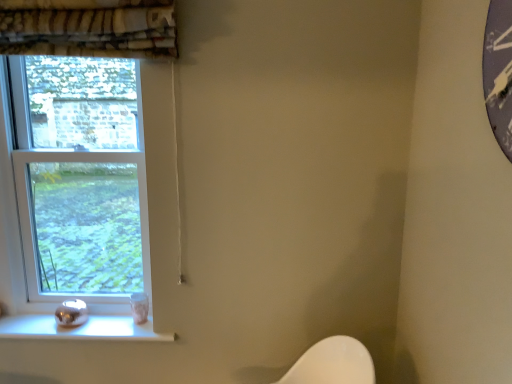
Locate an element on the screen. The image size is (512, 384). blank space situated above metallic silver bowl at lower left (from a real-world perspective) is located at coordinates (68, 325).